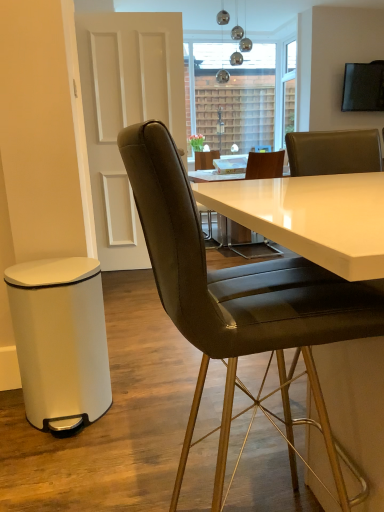
Question: From a real-world perspective, is transparent glass window at upper center physically below white matte bar stool at lower left?

Choices:
 (A) no
 (B) yes

Answer: (A)

Question: From the image's perspective, would you say transparent glass window at upper center is shown under white matte bar stool at lower left?

Choices:
 (A) yes
 (B) no

Answer: (B)

Question: From a real-world perspective, is transparent glass window at upper center on white matte bar stool at lower left?

Choices:
 (A) no
 (B) yes

Answer: (B)

Question: Can you confirm if transparent glass window at upper center is taller than white matte bar stool at lower left?

Choices:
 (A) yes
 (B) no

Answer: (A)

Question: From the image's perspective, is transparent glass window at upper center on white matte bar stool at lower left?

Choices:
 (A) yes
 (B) no

Answer: (A)

Question: Is transparent glass window at upper center at the left side of white matte bar stool at lower left?

Choices:
 (A) no
 (B) yes

Answer: (A)

Question: From the image's perspective, is white glossy door at upper left over leather/goldenchair at center?

Choices:
 (A) no
 (B) yes

Answer: (B)

Question: Is white glossy door at upper left facing towards leather/goldenchair at center?

Choices:
 (A) yes
 (B) no

Answer: (A)

Question: Is white glossy door at upper left positioned behind leather/goldenchair at center?

Choices:
 (A) yes
 (B) no

Answer: (A)

Question: Does white glossy door at upper left have a smaller size compared to leather/goldenchair at center?

Choices:
 (A) yes
 (B) no

Answer: (B)

Question: From a real-world perspective, is white glossy door at upper left on leather/goldenchair at center?

Choices:
 (A) no
 (B) yes

Answer: (B)

Question: Is white glossy door at upper left far from leather/goldenchair at center?

Choices:
 (A) yes
 (B) no

Answer: (A)

Question: Is white matte bar stool at lower left not inside leather/goldenchair at center?

Choices:
 (A) yes
 (B) no

Answer: (A)